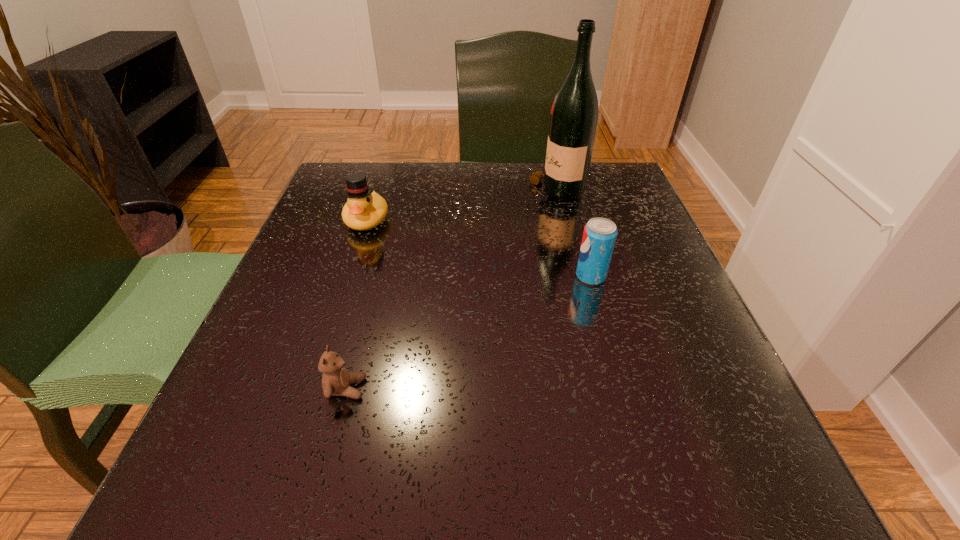
At what (x,y) coordinates should I click in order to perform the action: click on wine bottle. Please return your answer as a coordinate pair (x, y). Looking at the image, I should click on (574, 115).

Image resolution: width=960 pixels, height=540 pixels. I want to click on duck, so click(x=364, y=209).

Locate an element on the screen. The image size is (960, 540). soda can is located at coordinates (599, 236).

I want to click on the shortest object, so click(336, 380).

Image resolution: width=960 pixels, height=540 pixels. Find the location of `teddy bear`. teddy bear is located at coordinates (336, 380).

You are a GUI agent. You are given a task and a screenshot of the screen. Output one action in this format:
    pyautogui.click(x=<x>, y=<y>)
    Task: Click on the free region located on the surface of the wine bottle
    The image size is (960, 540).
    Given the screenshot: What is the action you would take?
    pyautogui.click(x=488, y=192)

Where is `free spot located on the surface of the wine bottle`? free spot located on the surface of the wine bottle is located at coordinates (355, 192).

The image size is (960, 540). Identify the location of free space located 0.140m on the surface of the wine bottle. (467, 192).

Identify the location of free space located on the front-facing side of the duck. (333, 324).

Find the location of a particular element. The image size is (960, 540). vacant space located 0.090m on the right of the third farthest object is located at coordinates click(x=655, y=276).